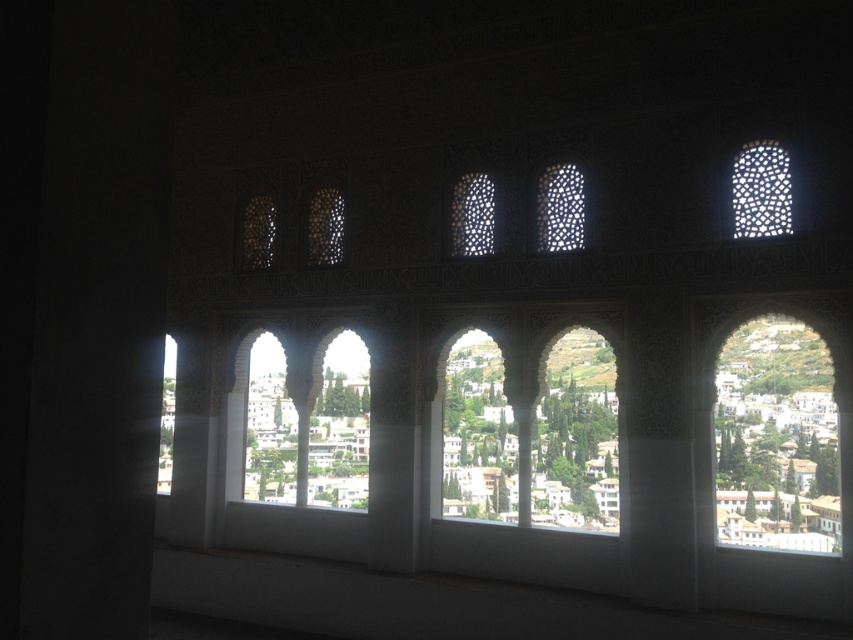
Question: Among these points, which one is nearest to the camera?

Choices:
 (A) (744, 211)
 (B) (575, 168)
 (C) (456, 250)
 (D) (251, 252)

Answer: (A)

Question: Observing the image, what is the correct spatial positioning of translucent glass lattice at center in reference to translucent glass window at upper left?

Choices:
 (A) left
 (B) right

Answer: (B)

Question: Can you confirm if translucent glass lattice at center is positioned below translucent lattice at center?

Choices:
 (A) yes
 (B) no

Answer: (A)

Question: Which of the following is the farthest from the observer?

Choices:
 (A) translucent lattice at center
 (B) translucent glass window at center

Answer: (A)

Question: Considering the relative positions of white lattice at upper right and translucent glass window at upper left in the image provided, where is white lattice at upper right located with respect to translucent glass window at upper left?

Choices:
 (A) left
 (B) right

Answer: (B)

Question: Which is nearer to the translucent glass window at upper left?

Choices:
 (A) translucent glass lattice at center
 (B) white lattice at upper right
 (C) translucent glass window at center
 (D) translucent lattice at center

Answer: (D)